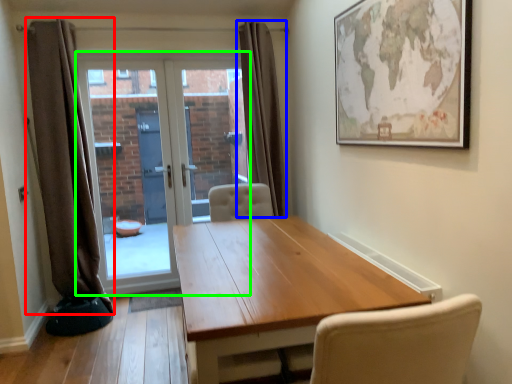
Question: Based on their relative distances, which object is farther from curtain (highlighted by a red box)? Choose from curtain (highlighted by a blue box) and door (highlighted by a green box).

Choices:
 (A) curtain
 (B) door

Answer: (A)